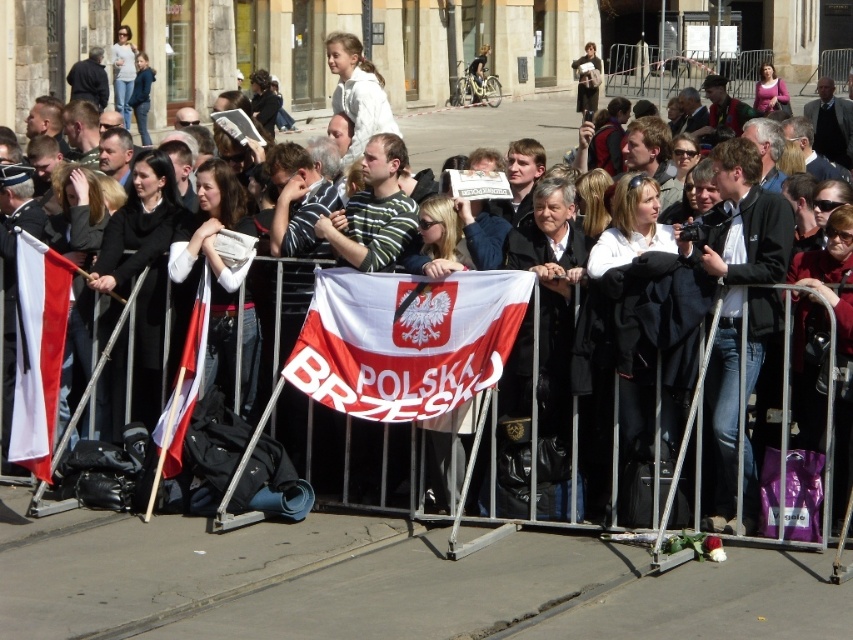
The image size is (853, 640). What are the coordinates of `black leather jacket at center` in the screenshot? It's located at (735, 292).

What do you see at coordinates (735, 292) in the screenshot?
I see `black leather jacket at center` at bounding box center [735, 292].

Where is `black leather jacket at center`? black leather jacket at center is located at coordinates (735, 292).

Can you confirm if whitematerial/textureflag at center is shorter than white fabric flag at center?

Indeed, whitematerial/textureflag at center has a lesser height compared to white fabric flag at center.

Is whitematerial/textureflag at center wider than white fabric flag at center?

Yes, whitematerial/textureflag at center is wider than white fabric flag at center.

This screenshot has height=640, width=853. What do you see at coordinates (405, 340) in the screenshot?
I see `whitematerial/textureflag at center` at bounding box center [405, 340].

Find the location of `whitematerial/textureflag at center`. whitematerial/textureflag at center is located at coordinates (405, 340).

Does whitematerial/textureflag at center have a smaller size compared to white cotton shirt at upper center?

No.

Who is shorter, whitematerial/textureflag at center or white cotton shirt at upper center?

With less height is whitematerial/textureflag at center.

Who is more forward, (399, 340) or (125, 32)?

Point (399, 340) is in front.

Locate an element on the screen. The width and height of the screenshot is (853, 640). whitematerial/textureflag at center is located at coordinates (405, 340).